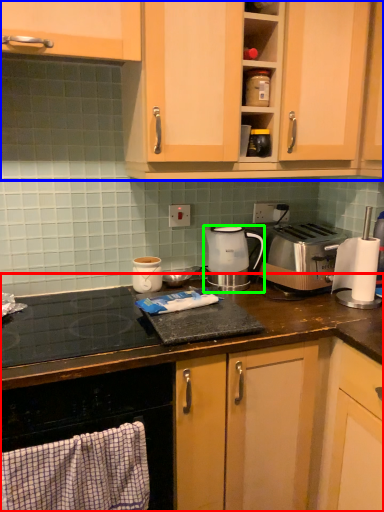
Question: Which is nearer to the countertop (highlighted by a red box)? cabinetry (highlighted by a blue box) or kitchen appliance (highlighted by a green box).

Choices:
 (A) cabinetry
 (B) kitchen appliance

Answer: (B)